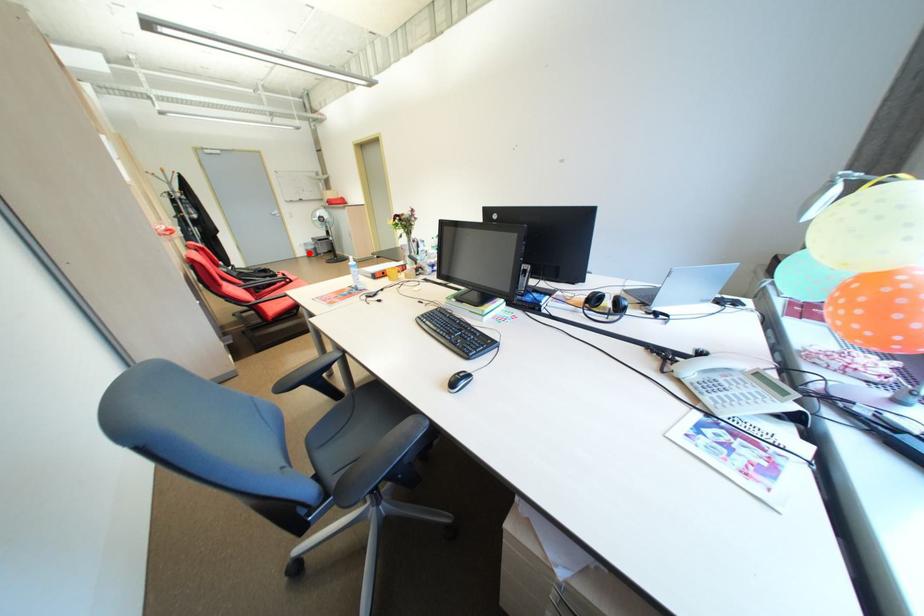
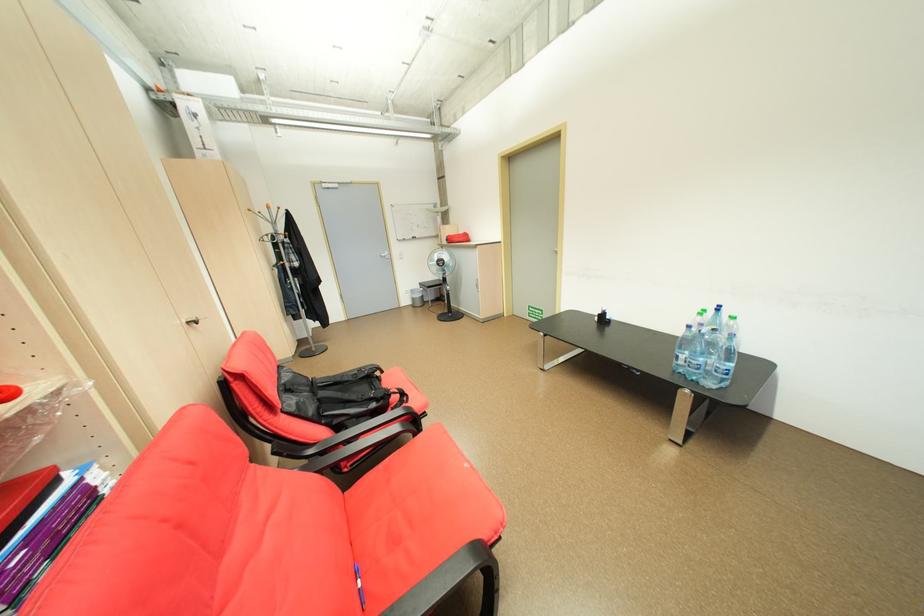
Where in the second image is the point corresponding to the highlighted location from the first image?

(415, 302)